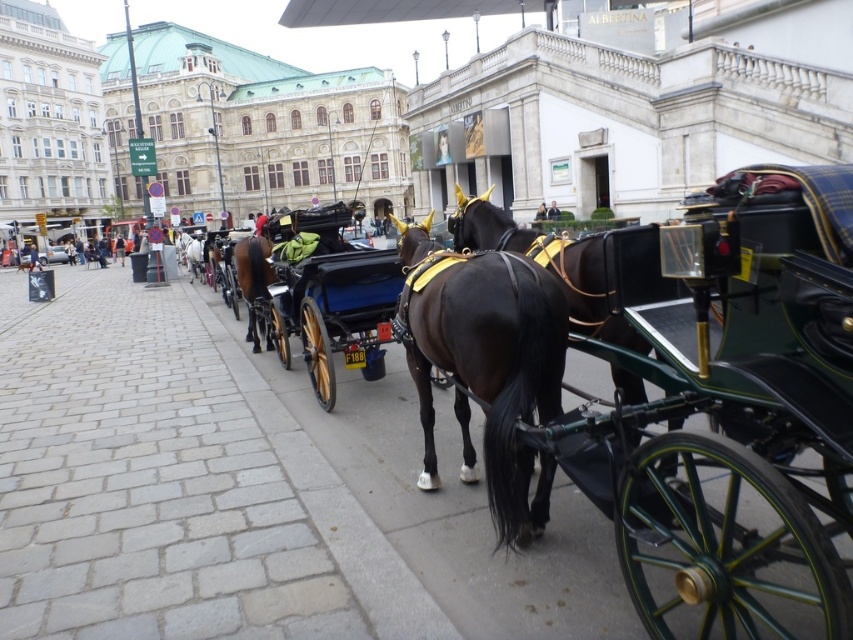
Who is more distant from viewer, (753, 332) or (497, 288)?

Point (497, 288)

Describe the element at coordinates (729, 422) in the screenshot. I see `shiny black cart at center` at that location.

Locate an element on the screen. Image resolution: width=853 pixels, height=640 pixels. shiny black cart at center is located at coordinates (729, 422).

Can you confirm if shiny black horse at center is wider than shiny brown horse at center?

Yes.

Is shiny black horse at center taller than shiny brown horse at center?

Yes.

Identify the location of shiny black horse at center. (550, 264).

Is shiny black cart at center positioned in front of shiny black horse at center?

That is True.

Between shiny black cart at center and shiny black horse at center, which one is positioned lower?

shiny black cart at center

Where is `shiny black cart at center`? This screenshot has height=640, width=853. shiny black cart at center is located at coordinates (729, 422).